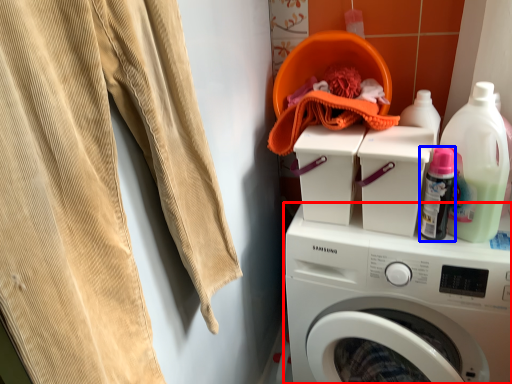
Question: Among these objects, which one is farthest to the camera, washing machine (highlighted by a red box) or bottle (highlighted by a blue box)?

Choices:
 (A) washing machine
 (B) bottle

Answer: (B)